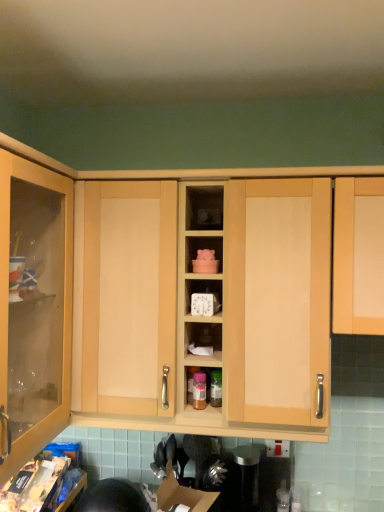
At what (x,y) coordinates should I click in order to perform the action: click on matte wood cabinet at center. Please return your answer as a coordinate pair (x, y). This screenshot has width=384, height=512. Looking at the image, I should click on (228, 309).

The width and height of the screenshot is (384, 512). I want to click on satin silver canister at center, so click(241, 479).

Image resolution: width=384 pixels, height=512 pixels. Describe the element at coordinates (204, 208) in the screenshot. I see `matte wood clock at center` at that location.

I want to click on matte wood cabinet at center, so click(x=228, y=309).

From a real-world perspective, is light wood cabinet at right on top of matte wood clock at center?

Result: Actually, light wood cabinet at right is physically below matte wood clock at center in the real world.

Who is bigger, light wood cabinet at right or matte wood clock at center?

light wood cabinet at right is bigger.

Between light wood cabinet at right and matte wood clock at center, which one has smaller width?

With smaller width is matte wood clock at center.

From the image's perspective, is light wood cabinet at right beneath matte wood clock at center?

Indeed, from the image's perspective, light wood cabinet at right is shown beneath matte wood clock at center.

Looking at this image, can you confirm if matte wood cabinet at center is shorter than satin silver canister at center?

In fact, matte wood cabinet at center may be taller than satin silver canister at center.

From a real-world perspective, relative to satin silver canister at center, is matte wood cabinet at center vertically above or below?

matte wood cabinet at center is situated higher than satin silver canister at center in the real world.

Which is nearer, (160,288) or (248,470)?

Point (160,288).

Considering the positions of objects matte wood cabinet at center and satin silver canister at center in the image provided, who is behind, matte wood cabinet at center or satin silver canister at center?

satin silver canister at center is behind.

Considering the relative sizes of matte wood clock at center and satin silver canister at center in the image provided, is matte wood clock at center bigger than satin silver canister at center?

No, matte wood clock at center is not bigger than satin silver canister at center.

Which object is closer to the camera taking this photo, matte wood clock at center or satin silver canister at center?

matte wood clock at center is closer to the camera.

In the scene shown: From a real-world perspective, which object stands above the other?

matte wood clock at center is physically above.

Is matte wood clock at center beside satin silver canister at center?

matte wood clock at center is not next to satin silver canister at center, and they're not touching.

Which of these two, matte wood cabinet at center or matte wood clock at center, is thinner?

matte wood clock at center is thinner.

Could you tell me if matte wood cabinet at center is turned towards matte wood clock at center?

Yes.

You are a GUI agent. You are given a task and a screenshot of the screen. Output one action in this format:
    pyautogui.click(x=<x>, y=<y>)
    Task: Click on the dresser below the matte wood clock at center (from the image's perspective)
    
    Given the screenshot: What is the action you would take?
    pyautogui.click(x=228, y=309)

Which object is further away from the camera, matte wood cabinet at center or matte wood clock at center?

matte wood clock at center is behind.

Is matte wood clock at center facing away from light wood cabinet at right?

No, light wood cabinet at right is not at the back of matte wood clock at center.

The height and width of the screenshot is (512, 384). Find the location of `cabinetry that is in front of the matte wood clock at center`. cabinetry that is in front of the matte wood clock at center is located at coordinates (358, 256).

Does matte wood clock at center have a greater width compared to light wood cabinet at right?

No.

Considering the sizes of matte wood clock at center and light wood cabinet at right in the image, is matte wood clock at center taller or shorter than light wood cabinet at right?

Clearly, matte wood clock at center is shorter compared to light wood cabinet at right.

What's the angular difference between light wood cabinet at right and matte wood cabinet at center's facing directions?

The facing directions of light wood cabinet at right and matte wood cabinet at center are 0.000259 degrees apart.

Considering the sizes of objects light wood cabinet at right and matte wood cabinet at center in the image provided, who is thinner, light wood cabinet at right or matte wood cabinet at center?

light wood cabinet at right.

From a real-world perspective, between light wood cabinet at right and matte wood cabinet at center, who is vertically lower?

matte wood cabinet at center.

In the image, there is a light wood cabinet at right. Where is `appliance below it (from a real-world perspective)`? Image resolution: width=384 pixels, height=512 pixels. appliance below it (from a real-world perspective) is located at coordinates (241, 479).

Does point (364, 325) come farther from viewer compared to point (254, 504)?

No.

Could you tell me if light wood cabinet at right is facing satin silver canister at center?

No, light wood cabinet at right is not facing towards satin silver canister at center.

Based on the photo, is light wood cabinet at right to the right of satin silver canister at center from the viewer's perspective?

Indeed, light wood cabinet at right is positioned on the right side of satin silver canister at center.

Where is `cabinet that is above the light wood cabinet at right (from the image's perspective)`? The width and height of the screenshot is (384, 512). cabinet that is above the light wood cabinet at right (from the image's perspective) is located at coordinates (204, 208).

Identify the location of appliance behind the matte wood cabinet at center. The width and height of the screenshot is (384, 512). (241, 479).

Considering their positions, is satin silver canister at center positioned closer to matte wood clock at center than matte wood cabinet at center?

The object closer to matte wood clock at center is matte wood cabinet at center.

Considering their positions, is light wood cabinet at right positioned closer to satin silver canister at center than matte wood clock at center?

Among the two, light wood cabinet at right is located nearer to satin silver canister at center.

When comparing their distances from matte wood clock at center, does light wood cabinet at right or satin silver canister at center seem closer?

The object closer to matte wood clock at center is light wood cabinet at right.

Looking at the image, which one is located closer to light wood cabinet at right, matte wood cabinet at center or satin silver canister at center?

matte wood cabinet at center is positioned closer to the anchor light wood cabinet at right.

From the picture: When comparing their distances from satin silver canister at center, does matte wood clock at center or light wood cabinet at right seem closer?

light wood cabinet at right lies closer to satin silver canister at center than the other object.

Looking at the image, which one is located further to satin silver canister at center, matte wood cabinet at center or matte wood clock at center?

Among the two, matte wood clock at center is located further to satin silver canister at center.

Looking at the image, which one is located closer to light wood cabinet at right, satin silver canister at center or matte wood cabinet at center?

matte wood cabinet at center lies closer to light wood cabinet at right than the other object.

Looking at the image, which one is located closer to light wood cabinet at right, matte wood clock at center or satin silver canister at center?

matte wood clock at center.

Where is `cabinetry between matte wood clock at center and satin silver canister at center from top to bottom`? The width and height of the screenshot is (384, 512). cabinetry between matte wood clock at center and satin silver canister at center from top to bottom is located at coordinates (358, 256).

You are a GUI agent. You are given a task and a screenshot of the screen. Output one action in this format:
    pyautogui.click(x=<x>, y=<y>)
    Task: Click on the dresser that lies between light wood cabinet at right and satin silver canister at center from top to bottom
    The image size is (384, 512).
    Given the screenshot: What is the action you would take?
    pyautogui.click(x=228, y=309)

At what (x,y) coordinates should I click in order to perform the action: click on dresser between matte wood clock at center and satin silver canister at center vertically. Please return your answer as a coordinate pair (x, y). Image resolution: width=384 pixels, height=512 pixels. Looking at the image, I should click on (228, 309).

Where is `cabinet situated between matte wood cabinet at center and light wood cabinet at right from left to right`? The height and width of the screenshot is (512, 384). cabinet situated between matte wood cabinet at center and light wood cabinet at right from left to right is located at coordinates (204, 208).